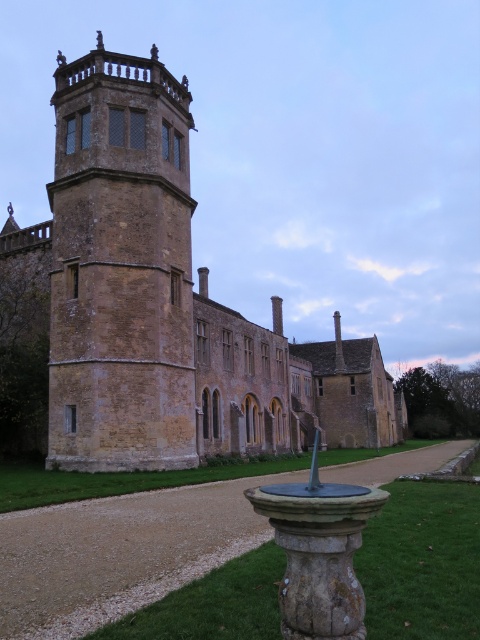
Measure the distance between point (106, 193) and camera.

The distance of point (106, 193) from camera is 49.77 meters.

Which is more to the right, brown stone castle at center or brown stone tower at upper left?

brown stone castle at center

Which is in front, point (91, 211) or point (56, 404)?

Point (56, 404)

The image size is (480, 640). I want to click on brown stone castle at center, so click(x=166, y=301).